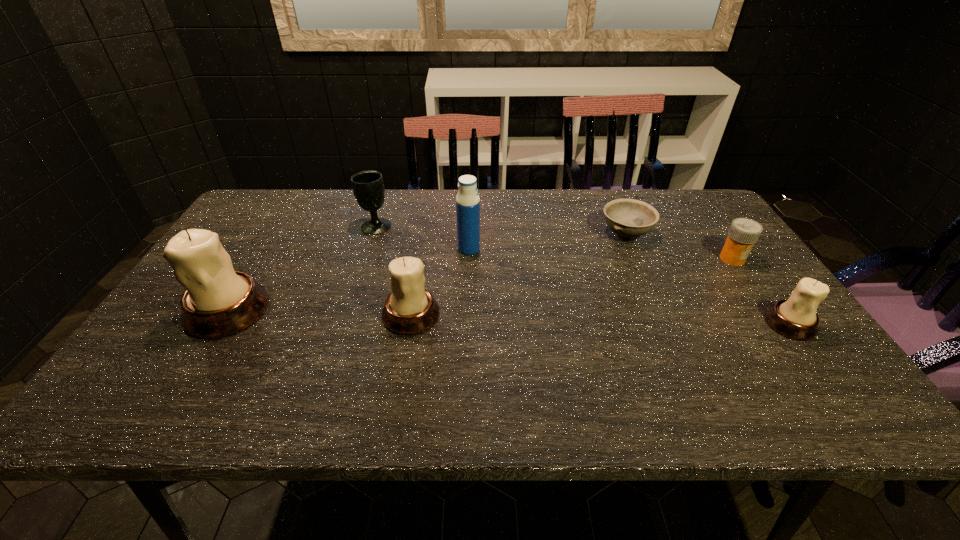
Identify the location of vacant area that lies between the second candle holder from left to right and the bowl. This screenshot has width=960, height=540. (518, 274).

You are a GUI agent. You are given a task and a screenshot of the screen. Output one action in this format:
    pyautogui.click(x=<x>, y=<y>)
    Task: Click on the free space that is in between the rightmost candle holder and the medicine
    Image resolution: width=960 pixels, height=540 pixels.
    Given the screenshot: What is the action you would take?
    pyautogui.click(x=761, y=291)

You are a GUI agent. You are given a task and a screenshot of the screen. Output one action in this format:
    pyautogui.click(x=<x>, y=<y>)
    Task: Click on the free space between the fourth object from right to left and the leftmost object
    This screenshot has height=540, width=960.
    Given the screenshot: What is the action you would take?
    pyautogui.click(x=348, y=280)

You are a GUI agent. You are given a task and a screenshot of the screen. Output one action in this format:
    pyautogui.click(x=<x>, y=<y>)
    Task: Click on the unoccupied position between the bowl and the rightmost candle holder
    The height and width of the screenshot is (540, 960).
    Given the screenshot: What is the action you would take?
    pyautogui.click(x=708, y=279)

You are a GUI agent. You are given a task and a screenshot of the screen. Output one action in this format:
    pyautogui.click(x=<x>, y=<y>)
    Task: Click on the vacant space in between the shortest candle holder and the water bottle
    The image size is (960, 540).
    Given the screenshot: What is the action you would take?
    pyautogui.click(x=630, y=286)

This screenshot has height=540, width=960. What are the coordinates of `free spot between the chalice and the shortest candle holder` in the screenshot? It's located at [x=583, y=275].

I want to click on vacant space in between the shortest candle holder and the second candle holder from right to left, so click(x=601, y=319).

This screenshot has height=540, width=960. I want to click on object that is the second closest to the second shortest object, so click(795, 318).

At what (x,y) coordinates should I click in order to perform the action: click on object that is the sixth closest one to the third object from right to left. Please return your answer as a coordinate pair (x, y). Image resolution: width=960 pixels, height=540 pixels. Looking at the image, I should click on (219, 301).

This screenshot has height=540, width=960. Find the location of `candle holder identified as the third closest to the water bottle`. candle holder identified as the third closest to the water bottle is located at coordinates (795, 318).